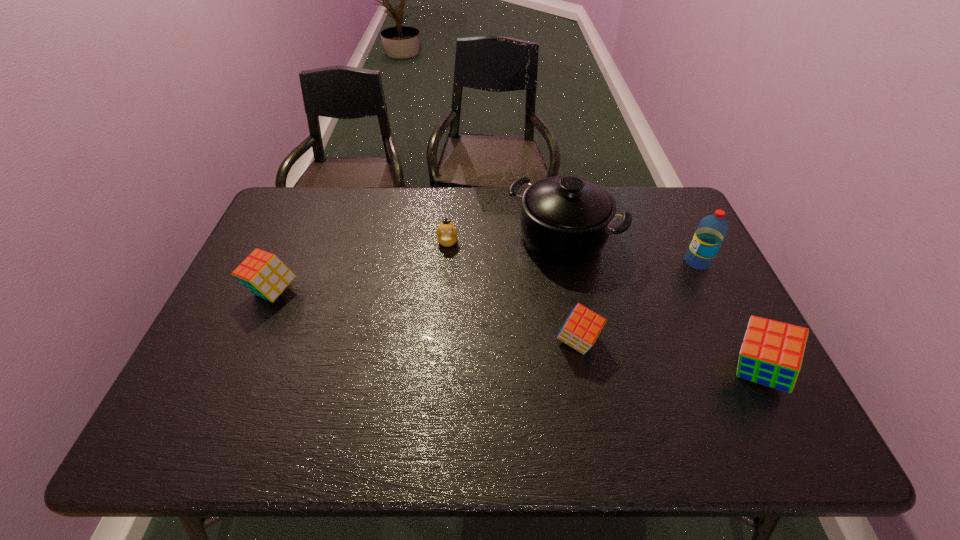
I want to click on vacant area located 0.050m on the back of the rightmost cube, so click(x=735, y=329).

Locate an element on the screen. This screenshot has width=960, height=540. vacant space located on the left of the saucepan is located at coordinates (457, 239).

Identify the location of blank area located on the face of the shortest object. (440, 345).

Locate an element on the screen. Image resolution: width=960 pixels, height=540 pixels. free space located on the front label of the water bottle is located at coordinates (566, 262).

In order to click on vacant region located on the front label of the water bottle in this screenshot , I will do `click(569, 262)`.

Locate an element on the screen. This screenshot has height=540, width=960. vacant space situated 0.100m on the front label of the water bottle is located at coordinates (651, 262).

Locate an element on the screen. The height and width of the screenshot is (540, 960). object positioned at the far edge is located at coordinates (565, 220).

Locate an element on the screen. This screenshot has width=960, height=540. object positioned at the near edge is located at coordinates (771, 354).

The width and height of the screenshot is (960, 540). I want to click on object at the left edge, so click(264, 274).

Find the location of a particular element. The width and height of the screenshot is (960, 540). cube that is positioned at the right edge is located at coordinates (771, 354).